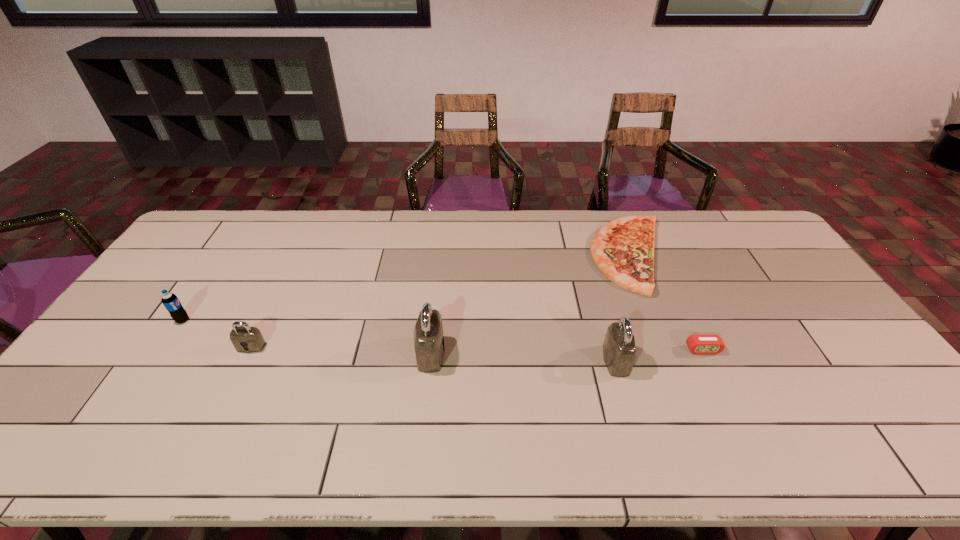
Locate an element on the screen. the leftmost padlock is located at coordinates (244, 338).

Where is `the fifth object from right to left`? The width and height of the screenshot is (960, 540). the fifth object from right to left is located at coordinates (244, 338).

The width and height of the screenshot is (960, 540). In order to click on the fourth object from right to left in this screenshot , I will do `click(428, 333)`.

The width and height of the screenshot is (960, 540). What are the coordinates of `the second shortest padlock` in the screenshot? It's located at (619, 350).

Identify the location of the rightmost padlock. (619, 350).

At what (x,y) coordinates should I click in order to perform the action: click on the farthest object. Please return your answer as a coordinate pair (x, y). This screenshot has width=960, height=540. Looking at the image, I should click on (623, 249).

This screenshot has height=540, width=960. In order to click on the leftmost object in this screenshot , I will do `click(171, 302)`.

Locate an element on the screen. the fourth shortest object is located at coordinates (171, 302).

Where is `alarm clock`? This screenshot has width=960, height=540. alarm clock is located at coordinates (701, 343).

Where is `free space located at the front of the third shortest object near the keyhole`? The height and width of the screenshot is (540, 960). free space located at the front of the third shortest object near the keyhole is located at coordinates (217, 416).